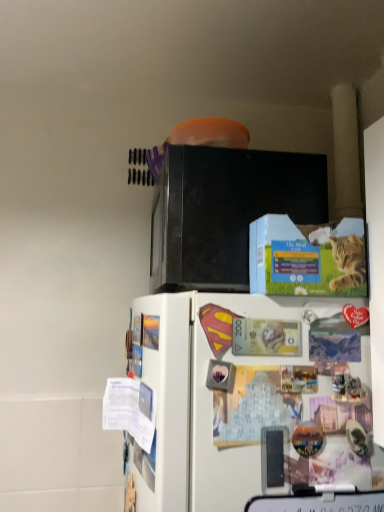
Measure the distance between white matte refrigerator at lower center and camera.

white matte refrigerator at lower center and camera are 68.27 centimeters apart.

Where is `blue cardboard box at upper center`? blue cardboard box at upper center is located at coordinates (307, 257).

Does white matte refrigerator at lower center turn towards blue cardboard box at upper center?

No, white matte refrigerator at lower center is not turned towards blue cardboard box at upper center.

Who is smaller, white matte refrigerator at lower center or blue cardboard box at upper center?

Smaller between the two is blue cardboard box at upper center.

Can you tell me how much white matte refrigerator at lower center and blue cardboard box at upper center differ in facing direction?

white matte refrigerator at lower center and blue cardboard box at upper center are facing 85.2 degrees away from each other.

Does white matte refrigerator at lower center come behind blue cardboard box at upper center?

No, white matte refrigerator at lower center is closer to the camera.

Is white matte refrigerator at lower center wider or thinner than black matte microwave oven at upper center?

In the image, white matte refrigerator at lower center appears to be wider than black matte microwave oven at upper center.

Locate an element on the screen. This screenshot has width=384, height=512. microwave oven that is behind the white matte refrigerator at lower center is located at coordinates (225, 211).

Is black matte microwave oven at upper center located within white matte refrigerator at lower center?

That's incorrect, black matte microwave oven at upper center is not inside white matte refrigerator at lower center.

Consider the image. Can you see black matte microwave oven at upper center touching blue cardboard box at upper center?

There is a gap between black matte microwave oven at upper center and blue cardboard box at upper center.

Is black matte microwave oven at upper center wider or thinner than blue cardboard box at upper center?

Clearly, black matte microwave oven at upper center has more width compared to blue cardboard box at upper center.

Is black matte microwave oven at upper center to the left of blue cardboard box at upper center from the viewer's perspective?

Yes.

Considering the relative sizes of blue cardboard box at upper center and black matte microwave oven at upper center in the image provided, is blue cardboard box at upper center shorter than black matte microwave oven at upper center?

Yes.

Between blue cardboard box at upper center and black matte microwave oven at upper center, which one has larger width?

Wider between the two is black matte microwave oven at upper center.

Is blue cardboard box at upper center inside the boundaries of black matte microwave oven at upper center, or outside?

blue cardboard box at upper center cannot be found inside black matte microwave oven at upper center.

From a real-world perspective, is blue cardboard box at upper center physically located above or below black matte microwave oven at upper center?

From a real-world perspective, blue cardboard box at upper center is physically below black matte microwave oven at upper center.

You are a GUI agent. You are given a task and a screenshot of the screen. Output one action in this format:
    pyautogui.click(x=<x>, y=<y>)
    Task: Click on the box that appears above the white matte refrigerator at lower center (from the image's perspective)
    
    Given the screenshot: What is the action you would take?
    pyautogui.click(x=307, y=257)

Is the surface of blue cardboard box at upper center in direct contact with white matte refrigerator at lower center?

No, blue cardboard box at upper center is not in contact with white matte refrigerator at lower center.

How different are the orientations of blue cardboard box at upper center and white matte refrigerator at lower center in degrees?

85.2 degrees.

Between blue cardboard box at upper center and white matte refrigerator at lower center, which one has larger size?

white matte refrigerator at lower center is bigger.

Considering the relative sizes of black matte microwave oven at upper center and white matte refrigerator at lower center in the image provided, is black matte microwave oven at upper center taller than white matte refrigerator at lower center?

Incorrect, the height of black matte microwave oven at upper center is not larger of that of white matte refrigerator at lower center.

Locate an element on the screen. The image size is (384, 512). microwave oven above the white matte refrigerator at lower center (from a real-world perspective) is located at coordinates (225, 211).

Is white matte refrigerator at lower center inside black matte microwave oven at upper center?

Definitely not — white matte refrigerator at lower center is not inside black matte microwave oven at upper center.

Which is in front, point (210, 151) or point (372, 486)?

The point (372, 486) is in front.

This screenshot has width=384, height=512. In the image, there is a blue cardboard box at upper center. Find the location of `refrigerator below it (from a real-world perspective)`. refrigerator below it (from a real-world perspective) is located at coordinates (249, 400).

This screenshot has width=384, height=512. Find the location of `refrigerator in front of the black matte microwave oven at upper center`. refrigerator in front of the black matte microwave oven at upper center is located at coordinates (249, 400).

From the image, which object appears to be nearer to blue cardboard box at upper center, white matte refrigerator at lower center or black matte microwave oven at upper center?

The object closer to blue cardboard box at upper center is black matte microwave oven at upper center.

From the image, which object appears to be nearer to white matte refrigerator at lower center, blue cardboard box at upper center or black matte microwave oven at upper center?

The object closer to white matte refrigerator at lower center is blue cardboard box at upper center.

Based on their spatial positions, is black matte microwave oven at upper center or blue cardboard box at upper center closer to white matte refrigerator at lower center?

blue cardboard box at upper center.

Based on their spatial positions, is white matte refrigerator at lower center or blue cardboard box at upper center closer to black matte microwave oven at upper center?

blue cardboard box at upper center lies closer to black matte microwave oven at upper center than the other object.

Which object lies further to the anchor point black matte microwave oven at upper center, blue cardboard box at upper center or white matte refrigerator at lower center?

white matte refrigerator at lower center.

Estimate the real-world distances between objects in this image. Which object is further from blue cardboard box at upper center, black matte microwave oven at upper center or white matte refrigerator at lower center?

white matte refrigerator at lower center is positioned further to the anchor blue cardboard box at upper center.

At what (x,y) coordinates should I click in order to perform the action: click on box between black matte microwave oven at upper center and white matte refrigerator at lower center in the up-down direction. Please return your answer as a coordinate pair (x, y). Looking at the image, I should click on tap(307, 257).